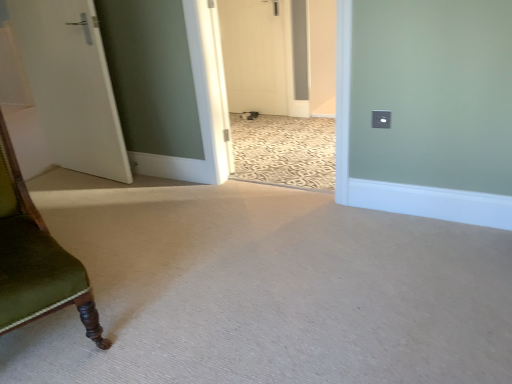
Question: From their relative heights in the image, would you say green velvet chair at left is taller or shorter than white matte door at center, the second door when ordered from front to back?

Choices:
 (A) tall
 (B) short

Answer: (B)

Question: From a real-world perspective, is green velvet chair at left above or below white matte door at center, which is the second door from left to right?

Choices:
 (A) below
 (B) above

Answer: (A)

Question: Which is farther from the green velvet chair at left?

Choices:
 (A) white matte door at center, the 1th door from the right
 (B) white matte door at left, the second door viewed from the right

Answer: (A)

Question: Considering the real-world distances, which object is farthest from the white matte door at left, which is the second door from back to front?

Choices:
 (A) white matte door at center, which ranks as the first door in back-to-front order
 (B) green velvet chair at left

Answer: (A)